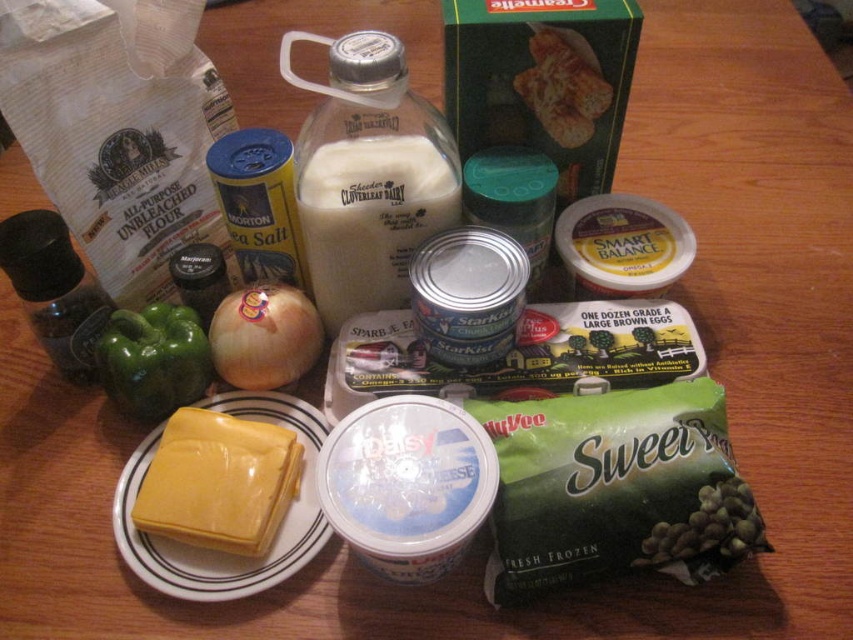
Question: Is green matte bell pepper at center left below yellow matte onion at center?

Choices:
 (A) no
 (B) yes

Answer: (B)

Question: Which point appears farthest from the camera in this image?

Choices:
 (A) (292, 314)
 (B) (450, 192)
 (C) (167, 305)

Answer: (C)

Question: Estimate the real-world distances between objects in this image. Which object is closer to the yellow matte onion at center?

Choices:
 (A) yellow cheese at center
 (B) green matte bell pepper at center left

Answer: (B)

Question: Can you confirm if white opaque bottle at center is positioned above yellow cheese at center?

Choices:
 (A) no
 (B) yes

Answer: (B)

Question: Which of the following is the farthest from the observer?

Choices:
 (A) green matte bell pepper at center left
 (B) yellow cheese at center

Answer: (A)

Question: Where is white opaque bottle at center located in relation to yellow matte onion at center in the image?

Choices:
 (A) above
 (B) below

Answer: (A)